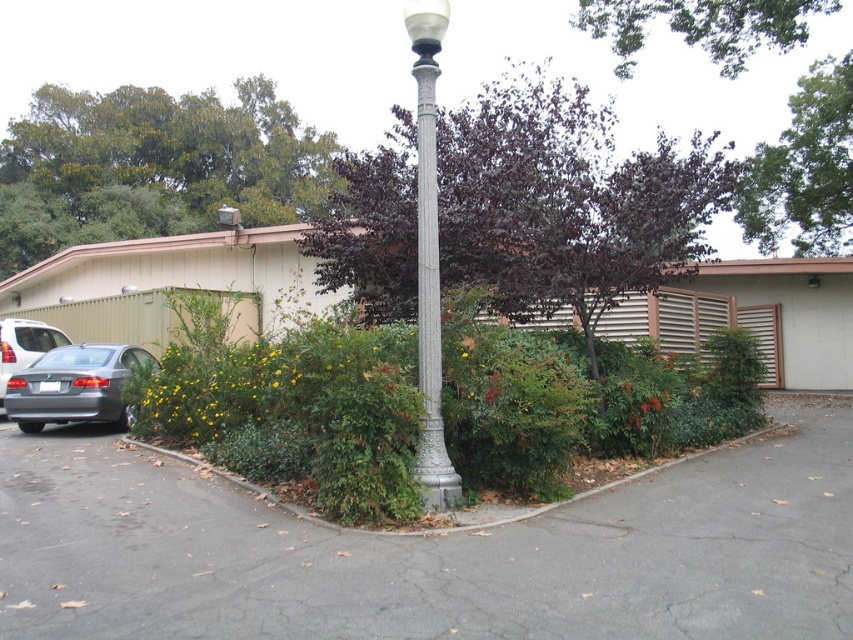
You are a landscape architect designing a new garden layout. You need to place a new bench between the green leafy tree at upper left and the dark purple leafy tree at upper center. Which tree should the bench be closer to if you want it to be proportionally balanced with their sizes?

The bench should be closer to the green leafy tree at upper left because it is smaller than the dark purple leafy tree at upper center, so balancing their sizes would require the bench to be nearer to the smaller tree to create visual equilibrium.

You are a delivery person trying to park your truck in the parking lot. You see the silver textured street light at center and the satin gray sedan at lower left. Which object is closer to the right side of the parking lot?

The silver textured street light at center is positioned on the right side of the satin gray sedan at lower left, so it is closer to the right side of the parking lot.

You are a landscape architect reviewing the parking lot design. You need to determine which tree is shorter between the green leafy tree at upper left and the dark purple leafy tree at upper center. Which one is shorter?

The green leafy tree at upper left is shorter than the dark purple leafy tree at upper center according to the description.